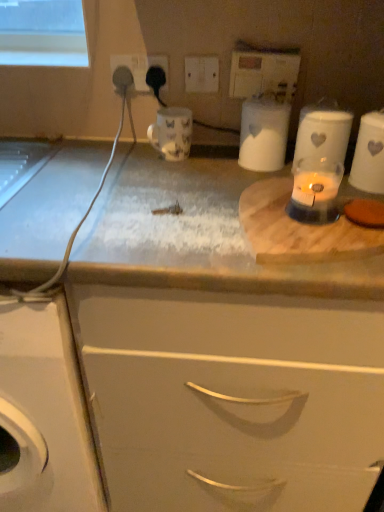
Image resolution: width=384 pixels, height=512 pixels. I want to click on free space to the left of translucent glass candle at center, so click(x=189, y=220).